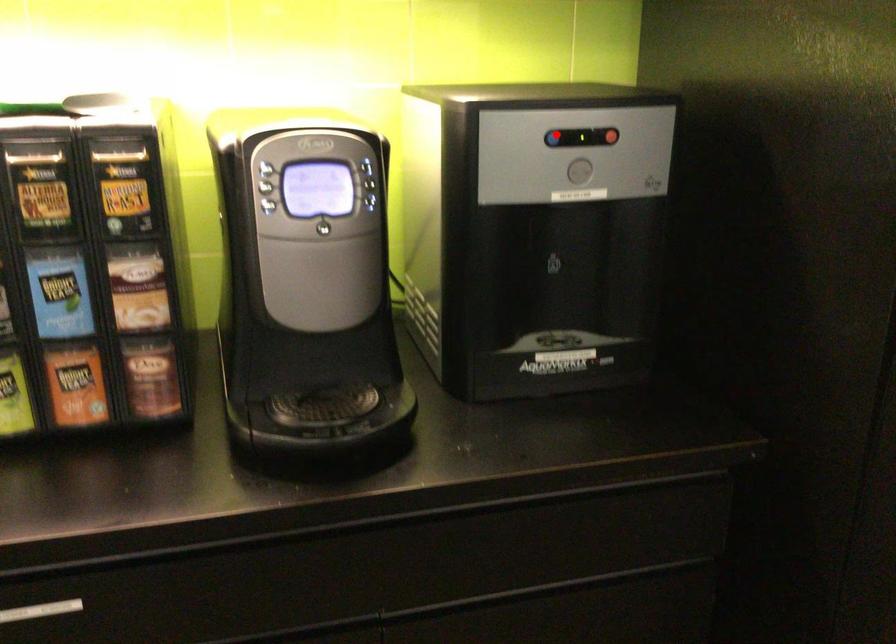
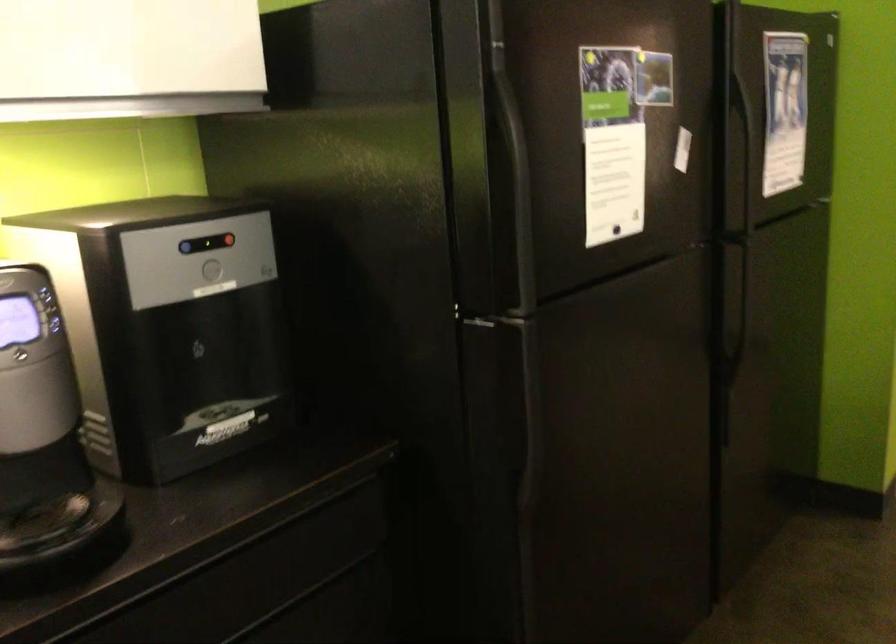
Locate, in the second image, the point that corresponds to the highlighted location in the first image.

(186, 247)